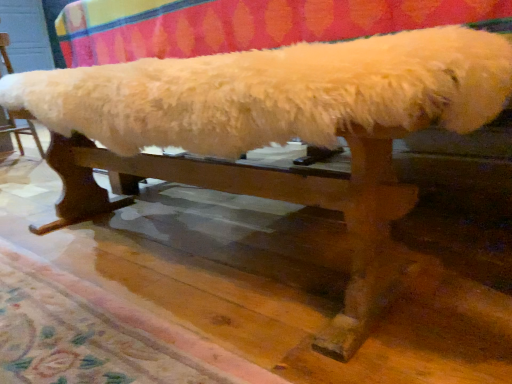
Find the location of `vacant area that lies to the right of carpeted floor at lower center`. vacant area that lies to the right of carpeted floor at lower center is located at coordinates (302, 285).